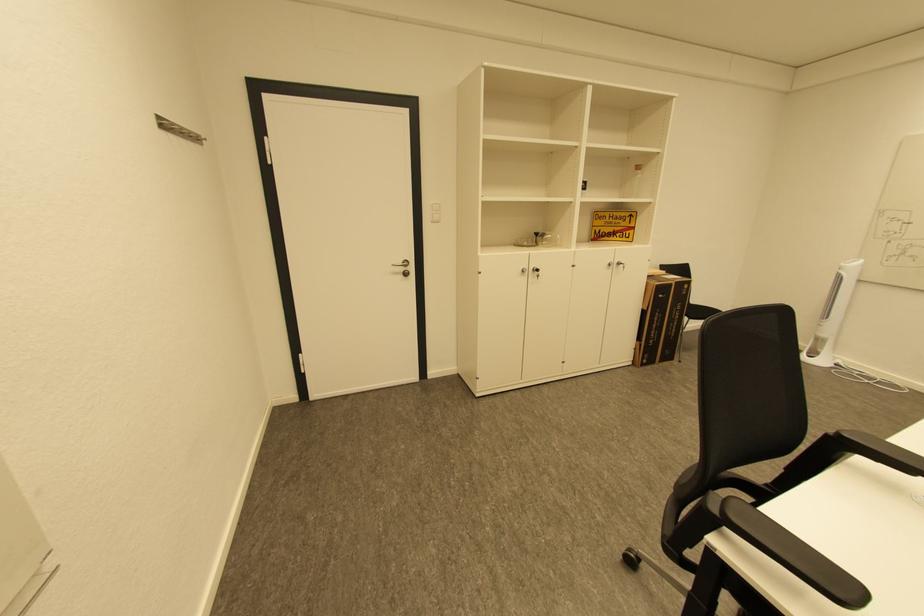
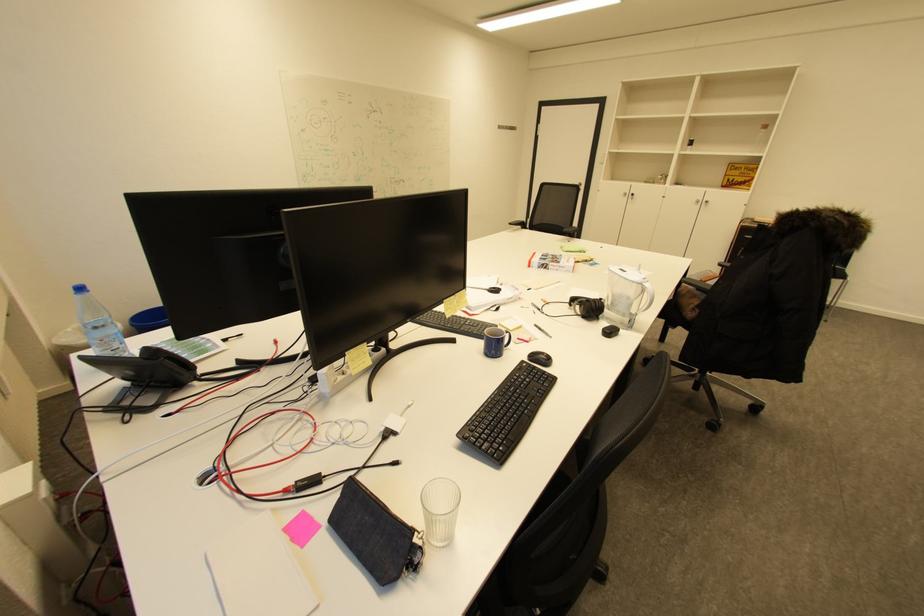
In the second image, find the point that corresponds to point 529,272 in the first image.

(630, 195)